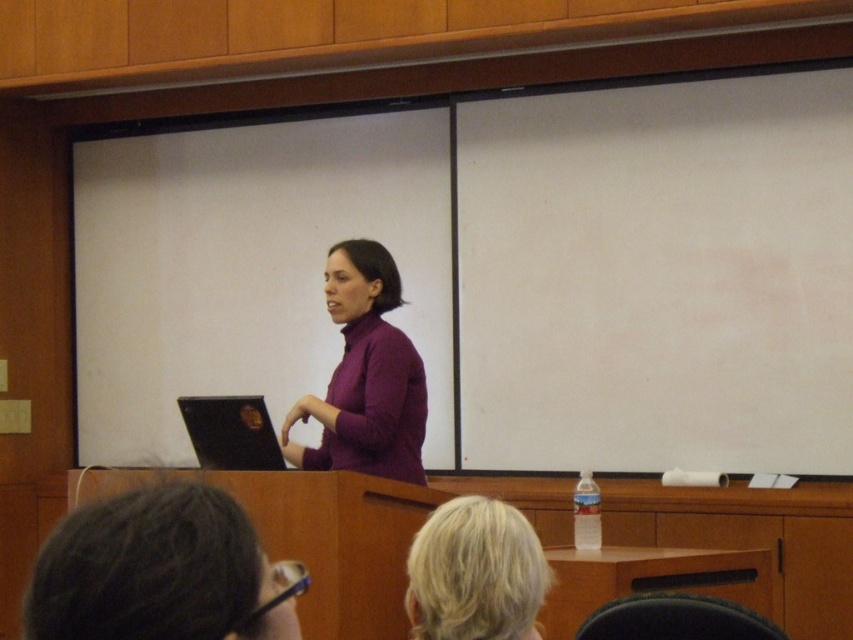
Question: Where is purple matte sweater at center located in relation to blonde hair at upper center in the image?

Choices:
 (A) left
 (B) right

Answer: (A)

Question: Which of the following is the closest to the observer?

Choices:
 (A) (467, 538)
 (B) (341, 410)

Answer: (A)

Question: Among these points, which one is nearest to the camera?

Choices:
 (A) (399, 362)
 (B) (535, 586)

Answer: (B)

Question: Observing the image, what is the correct spatial positioning of purple matte sweater at center in reference to blonde hair at upper center?

Choices:
 (A) below
 (B) above

Answer: (B)

Question: Does purple matte sweater at center appear on the left side of blonde hair at upper center?

Choices:
 (A) no
 (B) yes

Answer: (B)